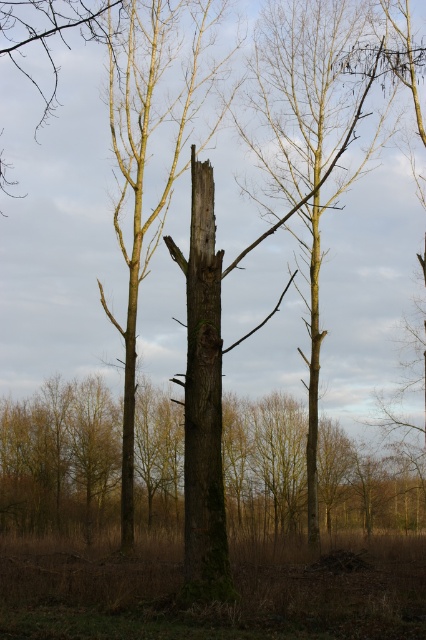
How far apart are smooth bark tree at center and green mossy bark at center?

16.33 meters

Who is more distant from viewer, (264, 131) or (210, 387)?

Positioned behind is point (264, 131).

Image resolution: width=426 pixels, height=640 pixels. What are the coordinates of `smooth bark tree at center` in the screenshot? It's located at (310, 140).